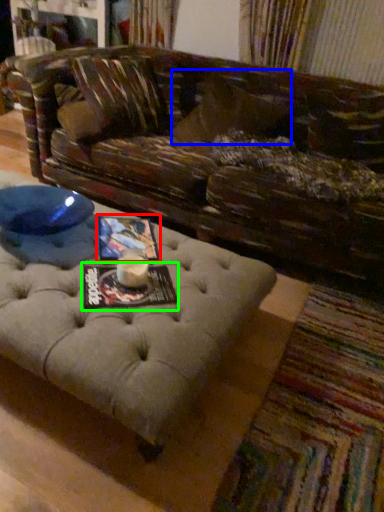
Question: Estimate the real-world distances between objects in this image. Which object is closer to magazine (highlighted by a red box), pillow (highlighted by a blue box) or magazine (highlighted by a green box)?

Choices:
 (A) pillow
 (B) magazine

Answer: (B)